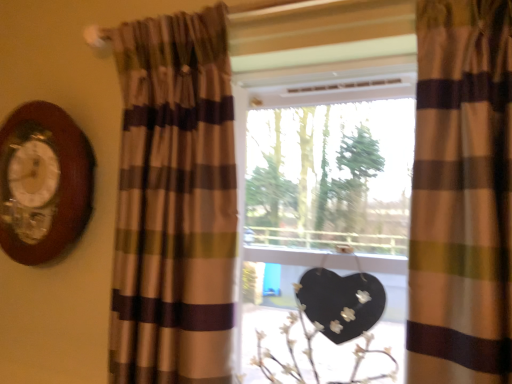
Question: In the image, is wooden clock at left on the left side or the right side of white matte floral arrangement at center?

Choices:
 (A) right
 (B) left

Answer: (B)

Question: From their relative heights in the image, would you say wooden clock at left is taller or shorter than white matte floral arrangement at center?

Choices:
 (A) short
 (B) tall

Answer: (B)

Question: Considering the real-world distances, which object is closest to the white matte floral arrangement at center?

Choices:
 (A) matte glass window at center
 (B) brown striped curtain at left, which is the first curtain in left-to-right order
 (C) brown striped curtain at right, the 2th curtain from the left
 (D) wooden clock at left

Answer: (A)

Question: Estimate the real-world distances between objects in this image. Which object is farther from the white matte floral arrangement at center?

Choices:
 (A) matte glass window at center
 (B) brown striped curtain at left, which is the first curtain in left-to-right order
 (C) wooden clock at left
 (D) brown striped curtain at right, the 2th curtain from the left

Answer: (C)